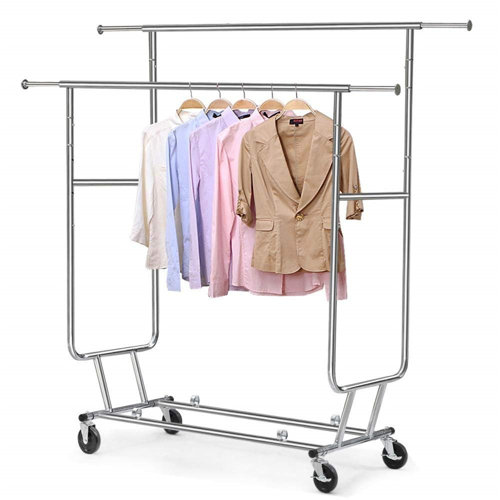
Find the location of a particular element. wooden portion hanger is located at coordinates (299, 105), (268, 105), (248, 105), (218, 102), (197, 102).